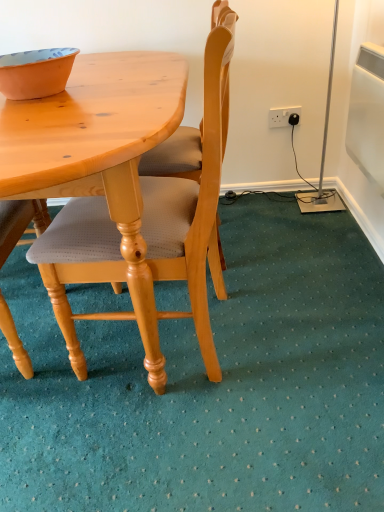
At what (x,y) coordinates should I click in order to perform the action: click on vacant space underneath light wood/light brown chair at center (from a real-world perspective). Please return your answer as a coordinate pair (x, y). Image resolution: width=384 pixels, height=512 pixels. Looking at the image, I should click on (169, 347).